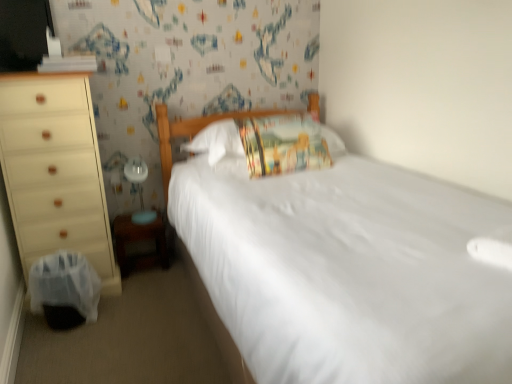
Question: In terms of size, does white glossy table lamp at lower left appear bigger or smaller than wooden changing table at lower left?

Choices:
 (A) small
 (B) big

Answer: (A)

Question: Choose the correct answer: Is white glossy table lamp at lower left inside wooden changing table at lower left or outside it?

Choices:
 (A) inside
 (B) outside

Answer: (B)

Question: Considering the real-world distances, which object is farthest from the white smooth bed at center?

Choices:
 (A) matte white dresser at left
 (B) black plastic swivel chair at lower left
 (C) wooden changing table at lower left
 (D) printed fabric pillow at center
 (E) white glossy table lamp at lower left

Answer: (E)

Question: Which of these objects is positioned closest to the matte white dresser at left?

Choices:
 (A) black plastic swivel chair at lower left
 (B) wooden changing table at lower left
 (C) printed fabric pillow at center
 (D) white smooth bed at center
 (E) white glossy table lamp at lower left

Answer: (A)